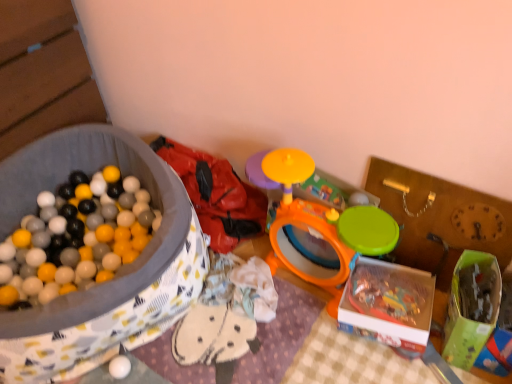
The width and height of the screenshot is (512, 384). In order to click on vacant space that is to the left of translucent plastic box at lower right, the second storage box from the left in this screenshot , I will do `click(317, 330)`.